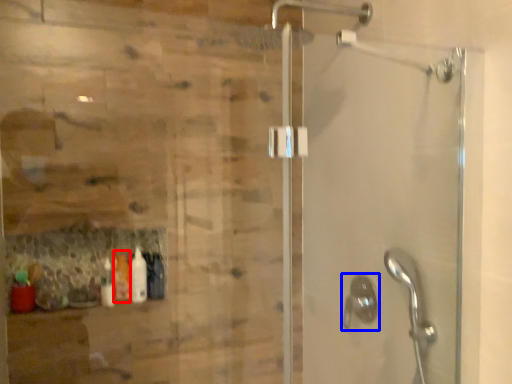
Question: Which point is closer to the camera, bottle (highlighted by a red box) or shower (highlighted by a blue box)?

Choices:
 (A) bottle
 (B) shower

Answer: (B)